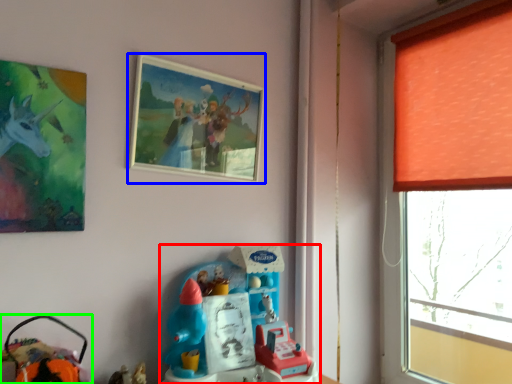
Question: Which object is positioned closest to toy (highlighted by a red box)? Select from picture frame (highlighted by a blue box) and toy (highlighted by a green box).

Choices:
 (A) picture frame
 (B) toy

Answer: (B)